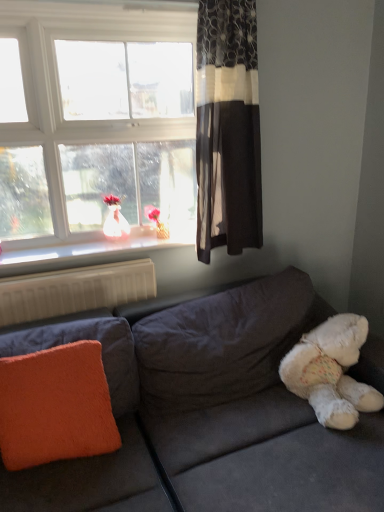
This screenshot has height=512, width=384. Find the location of `vacant space situated on the left part of white glossy doll at window`. vacant space situated on the left part of white glossy doll at window is located at coordinates (87, 244).